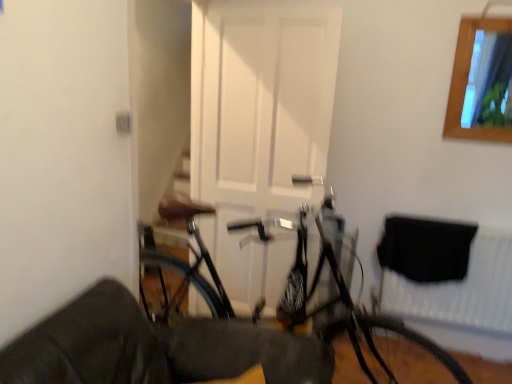
Question: Can you confirm if shiny metallic bicycle at center is positioned to the left of black fabric at lower right?

Choices:
 (A) yes
 (B) no

Answer: (A)

Question: Is shiny metallic bicycle at center wider than black fabric at lower right?

Choices:
 (A) no
 (B) yes

Answer: (B)

Question: From the image's perspective, is shiny metallic bicycle at center on top of black fabric at lower right?

Choices:
 (A) yes
 (B) no

Answer: (A)

Question: Is the position of shiny metallic bicycle at center more distant than that of black fabric at lower right?

Choices:
 (A) yes
 (B) no

Answer: (B)

Question: Is shiny metallic bicycle at center not within black fabric at lower right?

Choices:
 (A) no
 (B) yes

Answer: (B)

Question: Considering the positions of white matte door at center and shiny black tire at lower right in the image, is white matte door at center wider or thinner than shiny black tire at lower right?

Choices:
 (A) wide
 (B) thin

Answer: (B)

Question: From the image's perspective, is white matte door at center positioned above or below shiny black tire at lower right?

Choices:
 (A) below
 (B) above

Answer: (B)

Question: In terms of size, does white matte door at center appear bigger or smaller than shiny black tire at lower right?

Choices:
 (A) small
 (B) big

Answer: (B)

Question: Is white matte door at center inside the boundaries of shiny black tire at lower right, or outside?

Choices:
 (A) inside
 (B) outside

Answer: (B)

Question: From the image's perspective, is shiny black tire at lower right above or below white matte door at center?

Choices:
 (A) above
 (B) below

Answer: (B)

Question: Is shiny black tire at lower right to the left or to the right of white matte door at center in the image?

Choices:
 (A) left
 (B) right

Answer: (B)

Question: Does point (367, 344) appear closer or farther from the camera than point (215, 152)?

Choices:
 (A) closer
 (B) farther

Answer: (A)

Question: From a real-world perspective, is shiny black tire at lower right physically located above or below white matte door at center?

Choices:
 (A) above
 (B) below

Answer: (B)

Question: In terms of width, does wooden frame at upper right look wider or thinner when compared to white matte door at center?

Choices:
 (A) wide
 (B) thin

Answer: (B)

Question: Based on their positions, is wooden frame at upper right located to the left or right of white matte door at center?

Choices:
 (A) right
 (B) left

Answer: (A)